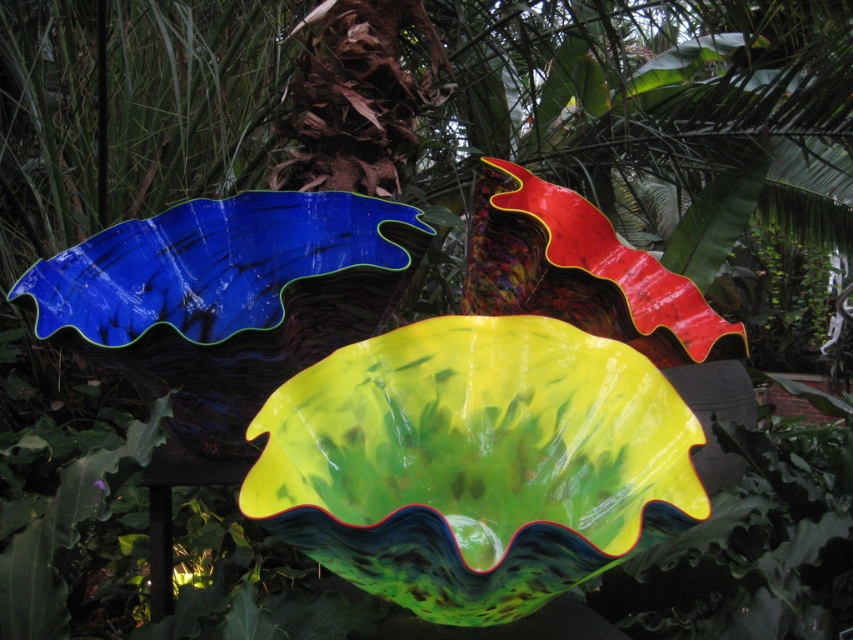
Question: Which point is farther from the camera taking this photo?

Choices:
 (A) (489, 342)
 (B) (496, 257)

Answer: (B)

Question: Does green glossy glass bowl at center have a larger size compared to shiny red glass leaf at center?

Choices:
 (A) yes
 (B) no

Answer: (B)

Question: Which point is farther to the camera?

Choices:
 (A) (309, 385)
 (B) (610, 259)

Answer: (B)

Question: Can you confirm if green glossy glass bowl at center is thinner than shiny red glass leaf at center?

Choices:
 (A) no
 (B) yes

Answer: (B)

Question: Does green glossy glass bowl at center have a larger size compared to shiny red glass leaf at center?

Choices:
 (A) yes
 (B) no

Answer: (B)